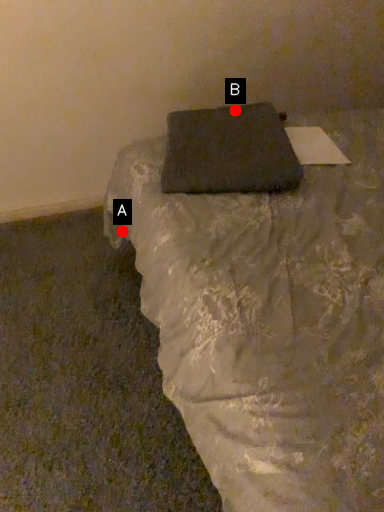
Question: Two points are circled on the image, labeled by A and B beside each circle. Which point is farther from the camera taking this photo?

Choices:
 (A) A is further
 (B) B is further

Answer: (B)